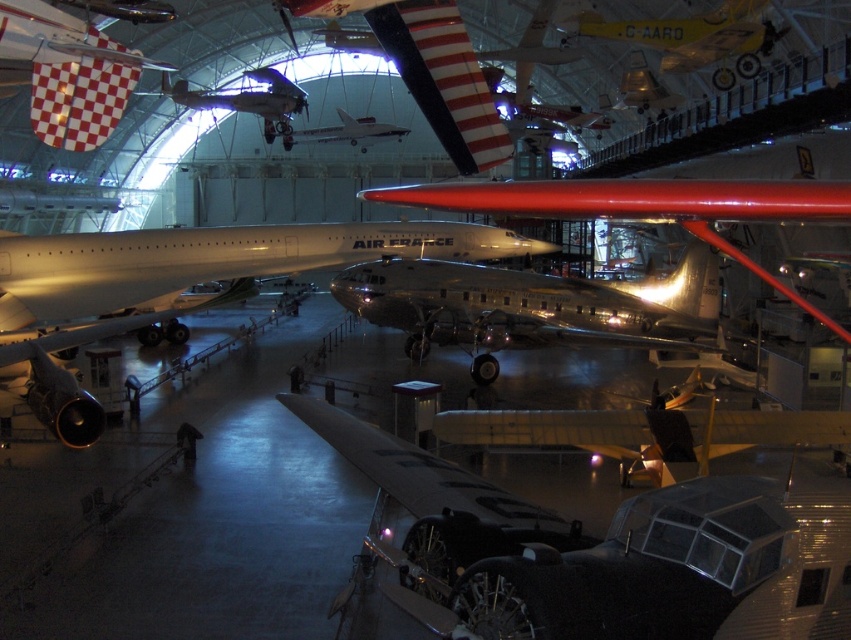
Which is more to the left, polished silver airplane at center or yellow polished wood airplane at upper center?

From the viewer's perspective, polished silver airplane at center appears more on the left side.

Who is higher up, polished silver airplane at center or yellow polished wood airplane at upper center?

yellow polished wood airplane at upper center is higher up.

Identify the location of polished silver airplane at center. (501, 308).

At what (x,y) coordinates should I click in order to perform the action: click on polished silver airplane at center. Please return your answer as a coordinate pair (x, y). The height and width of the screenshot is (640, 851). Looking at the image, I should click on (501, 308).

Can you confirm if shiny silver airplane at lower right is thinner than polished silver airplane at center?

No.

Measure the distance between shiny silver airplane at lower right and polished silver airplane at center.

10.76 meters

Locate an element on the screen. The width and height of the screenshot is (851, 640). shiny silver airplane at lower right is located at coordinates (601, 554).

Does polished silver airplane at center appear over shiny silver airplane at upper center?

No, polished silver airplane at center is not above shiny silver airplane at upper center.

This screenshot has width=851, height=640. What do you see at coordinates (501, 308) in the screenshot?
I see `polished silver airplane at center` at bounding box center [501, 308].

Image resolution: width=851 pixels, height=640 pixels. I want to click on polished silver airplane at center, so click(501, 308).

Find the location of a particular element. polished silver airplane at center is located at coordinates (501, 308).